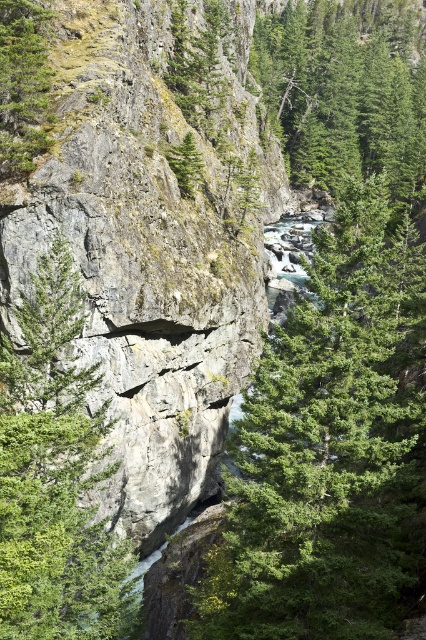
Question: Considering the real-world distances, which object is farthest from the green rough rock at center?

Choices:
 (A) green leafy tree at center
 (B) green matte tree at upper left

Answer: (B)

Question: Is green rough rock at center to the right of green matte tree at upper left from the viewer's perspective?

Choices:
 (A) no
 (B) yes

Answer: (B)

Question: Does green rough rock at center have a lesser width compared to green matte tree at upper left?

Choices:
 (A) yes
 (B) no

Answer: (B)

Question: Which point is closer to the camera taking this photo?

Choices:
 (A) (253, 584)
 (B) (74, 624)
 (C) (193, 141)

Answer: (A)

Question: Estimate the real-world distances between objects in this image. Which object is farther from the green textured tree at upper center?

Choices:
 (A) green leafy tree at center
 (B) green matte tree at upper left
 (C) green rough rock at center
 (D) green rough tree at center

Answer: (B)

Question: Does green rough rock at center have a larger size compared to green textured tree at upper center?

Choices:
 (A) yes
 (B) no

Answer: (B)